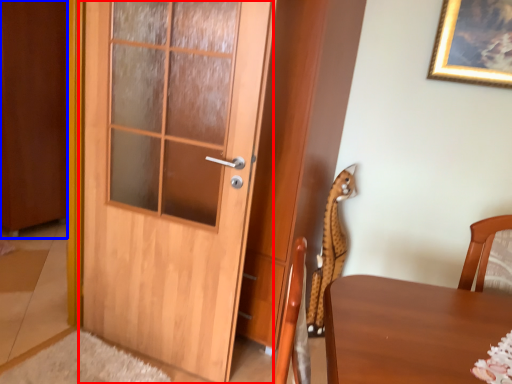
Question: Which point is closer to the camera, door (highlighted by a red box) or barn door (highlighted by a blue box)?

Choices:
 (A) door
 (B) barn door

Answer: (A)